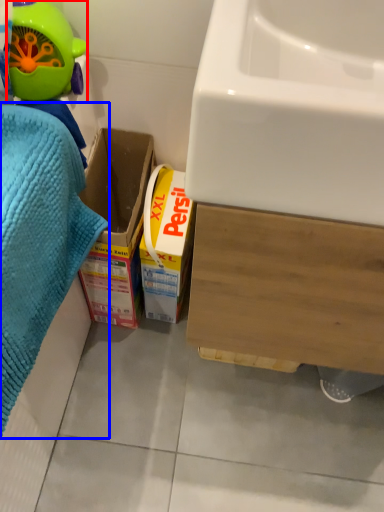
Question: Which object is further to the camera taking this photo, toy (highlighted by a red box) or bath towel (highlighted by a blue box)?

Choices:
 (A) toy
 (B) bath towel

Answer: (A)